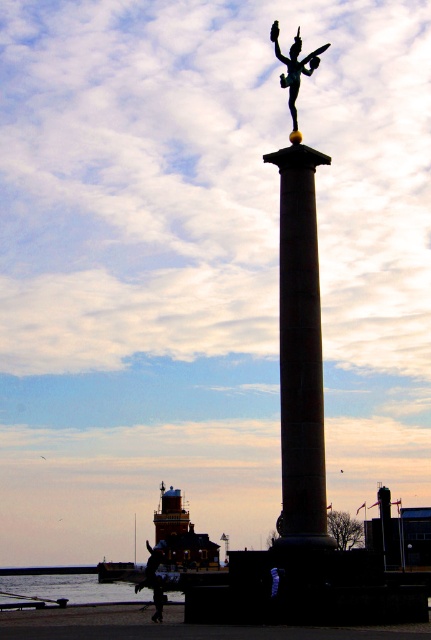
Question: Which of the following is the closest to the observer?

Choices:
 (A) (327, 42)
 (B) (306, 294)
 (C) (46, 580)
 (D) (156, 580)

Answer: (B)

Question: Is transparent water at lower left positioned before dark skin smooth person at lower center?

Choices:
 (A) no
 (B) yes

Answer: (A)

Question: Can you confirm if bronze column at center is positioned to the left of silvery metallic statue at upper center?

Choices:
 (A) no
 (B) yes

Answer: (B)

Question: Which of the following is the closest to the observer?

Choices:
 (A) (274, 40)
 (B) (303, 275)

Answer: (B)

Question: Which point appears closest to the camera in this image?

Choices:
 (A) (81, 586)
 (B) (318, 340)
 (C) (302, 68)
 (D) (161, 616)

Answer: (B)

Question: Can you confirm if bronze column at center is thinner than transparent water at lower left?

Choices:
 (A) no
 (B) yes

Answer: (B)